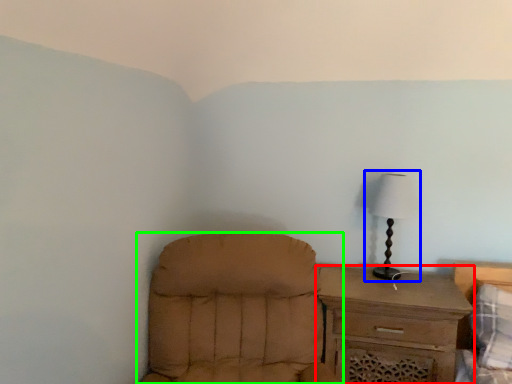
Question: Which object is the farthest from chest of drawers (highlighted by a red box)? Choose among these: lamp (highlighted by a blue box) or chair (highlighted by a green box).

Choices:
 (A) lamp
 (B) chair

Answer: (B)